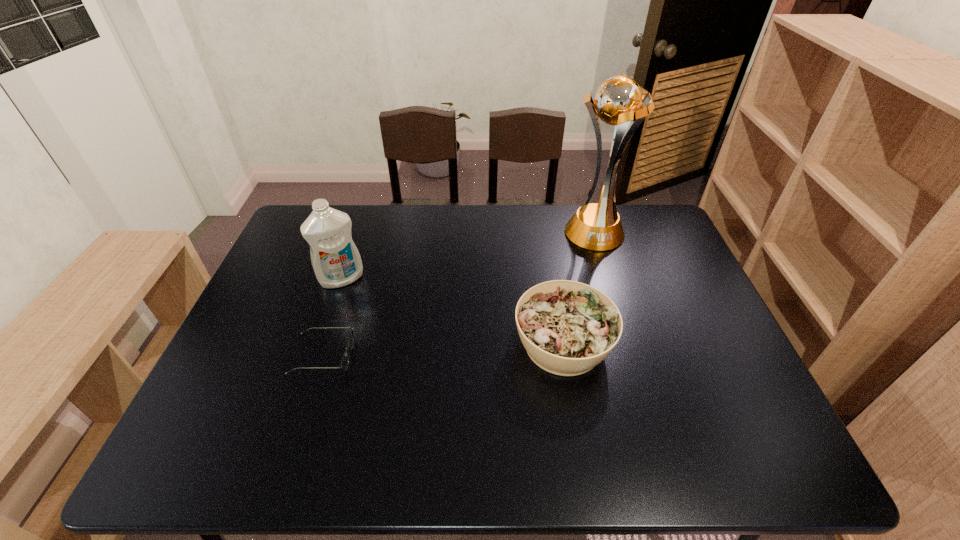
Where is `the farthest object`? The width and height of the screenshot is (960, 540). the farthest object is located at coordinates (620, 101).

This screenshot has width=960, height=540. Identify the location of the tallest object. (620, 101).

The width and height of the screenshot is (960, 540). In order to click on detergent in this screenshot , I will do `click(336, 261)`.

Locate an element on the screen. The height and width of the screenshot is (540, 960). the second farthest object is located at coordinates (336, 261).

The image size is (960, 540). What are the coordinates of `salad` in the screenshot? It's located at (567, 328).

Locate an element on the screen. The width and height of the screenshot is (960, 540). the shortest object is located at coordinates (344, 364).

I want to click on free space located on the front-facing side of the trophy, so click(617, 312).

You are a GUI agent. You are given a task and a screenshot of the screen. Output one action in this format:
    pyautogui.click(x=<x>, y=<y>)
    Task: Click on the vacant point located on the back of the third nearest object
    
    Given the screenshot: What is the action you would take?
    pyautogui.click(x=353, y=242)

This screenshot has height=540, width=960. What are the coordinates of `vacant region located 0.260m on the left of the second shortest object` in the screenshot? It's located at pos(413,345).

You are a GUI agent. You are given a task and a screenshot of the screen. Output one action in this format:
    pyautogui.click(x=<x>, y=<y>)
    Task: Click on the free space located 0.170m through the lenses of the shortest object
    This screenshot has width=960, height=540.
    Given the screenshot: What is the action you would take?
    pyautogui.click(x=419, y=356)